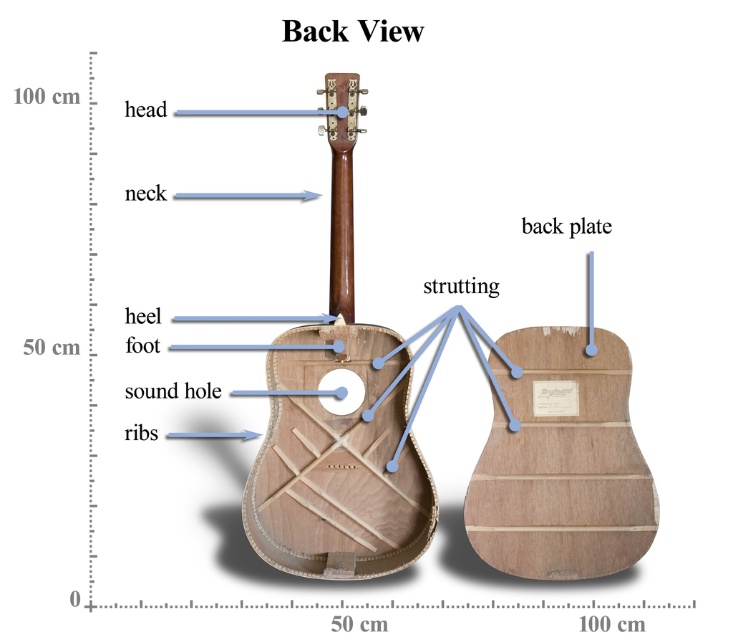
Question: From the image, what is the correct spatial relationship of natural wood guitar at center in relation to natural wood strutting at center?

Choices:
 (A) above
 (B) below

Answer: (A)

Question: Can you confirm if natural wood guitar at center is bigger than natural wood strutting at center?

Choices:
 (A) yes
 (B) no

Answer: (A)

Question: Which of the following is the farthest from the observer?

Choices:
 (A) (402, 416)
 (B) (633, 452)

Answer: (A)

Question: Which point is closer to the camera?

Choices:
 (A) natural wood guitar at center
 (B) natural wood strutting at center

Answer: (B)

Question: Does natural wood guitar at center lie behind natural wood strutting at center?

Choices:
 (A) no
 (B) yes

Answer: (B)